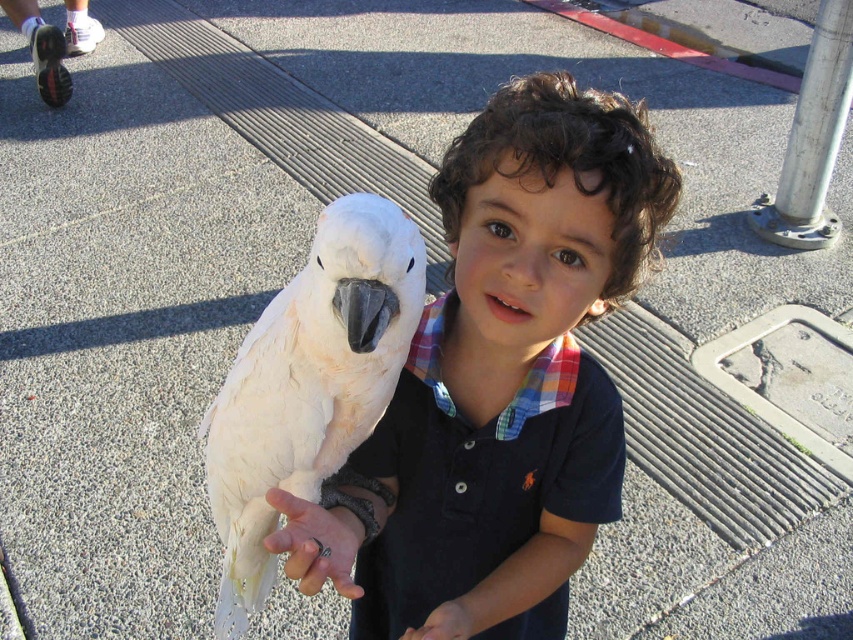
Does white feathered parrot at center have a larger size compared to white matte hand at lower center?

Correct, white feathered parrot at center is larger in size than white matte hand at lower center.

Looking at this image, who is taller, white feathered parrot at center or white matte hand at lower center?

white feathered parrot at center is taller.

Is point (212, 497) positioned before point (419, 637)?

No.

Where is `white feathered parrot at center`? The height and width of the screenshot is (640, 853). white feathered parrot at center is located at coordinates 308,385.

In the scene shown: Between matte blue shirt at center and white matte hand at center, which one is positioned higher?

white matte hand at center is higher up.

Is matte blue shirt at center in front of white matte hand at center?

No.

Does point (553, 515) come closer to viewer compared to point (386, 513)?

No.

Locate an element on the screen. This screenshot has height=640, width=853. matte blue shirt at center is located at coordinates (561, 512).

Who is more distant from viewer, (556,336) or (345,284)?

Positioned behind is point (556,336).

Image resolution: width=853 pixels, height=640 pixels. Describe the element at coordinates (511, 368) in the screenshot. I see `white feathered bird at upper left` at that location.

Identify the location of white feathered bird at upper left. Image resolution: width=853 pixels, height=640 pixels. (511, 368).